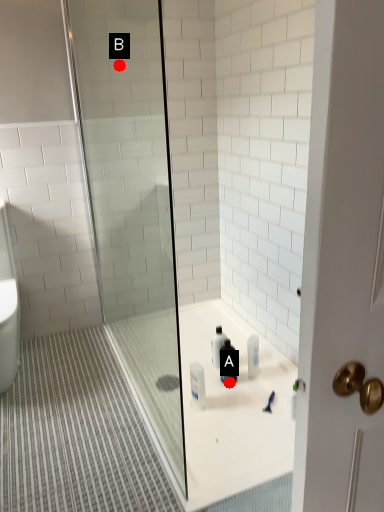
Question: Two points are circled on the image, labeled by A and B beside each circle. Which point appears closest to the camera in this image?

Choices:
 (A) A is closer
 (B) B is closer

Answer: (A)